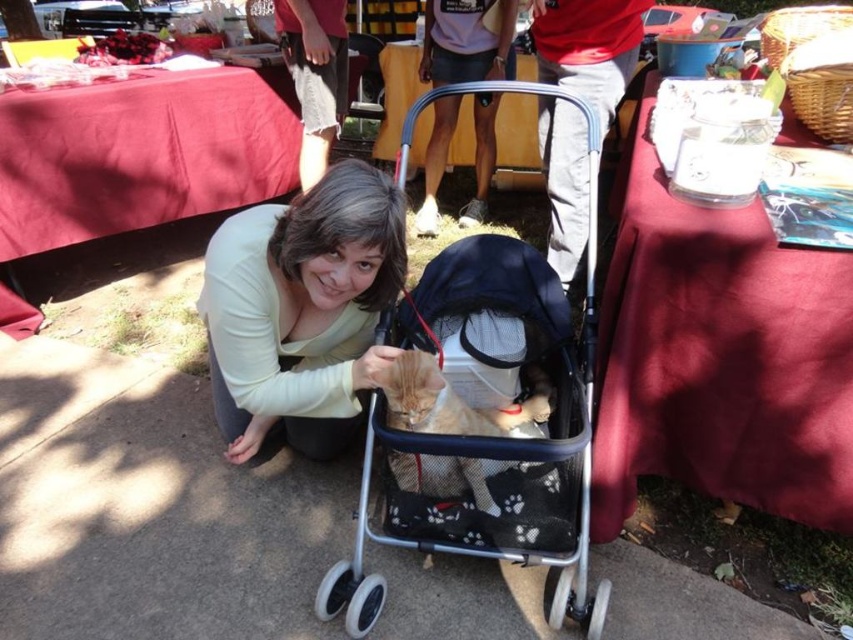
You are standing in the market area and want to take a photo of the two points mentioned. Which point, point (848, 328) or point (401, 372), is closer to your camera?

Point (848, 328) is closer to the camera than point (401, 372).

You are a photographer standing in front of the scene. You notice the smooth red cloth at upper right and the orange fur cat at center. Which object is higher in the image?

The smooth red cloth at upper right is much taller than the orange fur cat at center, so the smooth red cloth at upper right is higher in the image.

You are a photographer at a fair. You want to take a photo of the matte yellow shirt at center without the smooth red cloth at upper right blocking it. What should you do?

Move the camera to the left side so the matte yellow shirt at center is visible without the smooth red cloth at upper right in front of it.